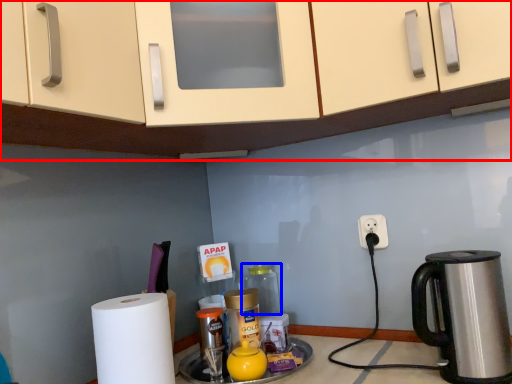
Question: Which point is closer to the camera, cabinetry (highlighted by a red box) or bottle (highlighted by a blue box)?

Choices:
 (A) cabinetry
 (B) bottle

Answer: (A)